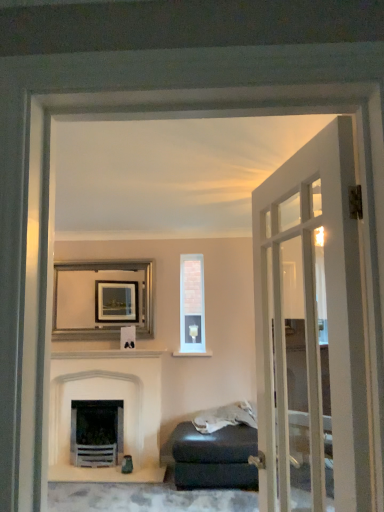
Question: Is matte black ottoman at lower right outside white glass door at right?

Choices:
 (A) no
 (B) yes

Answer: (B)

Question: Would you say matte black ottoman at lower right is a long distance from white glass door at right?

Choices:
 (A) yes
 (B) no

Answer: (B)

Question: From the image's perspective, would you say matte black ottoman at lower right is positioned over white glass door at right?

Choices:
 (A) no
 (B) yes

Answer: (A)

Question: Could you tell me if matte black ottoman at lower right is turned towards white glass door at right?

Choices:
 (A) yes
 (B) no

Answer: (B)

Question: Could white glass door at right be considered to be inside matte black ottoman at lower right?

Choices:
 (A) no
 (B) yes

Answer: (A)

Question: Is silver metallic picture frame at upper center situated inside gray leather ottoman at lower right or outside?

Choices:
 (A) inside
 (B) outside

Answer: (B)

Question: Considering the positions of silver metallic picture frame at upper center and gray leather ottoman at lower right in the image, is silver metallic picture frame at upper center bigger or smaller than gray leather ottoman at lower right?

Choices:
 (A) small
 (B) big

Answer: (A)

Question: Looking at their shapes, would you say silver metallic picture frame at upper center is wider or thinner than gray leather ottoman at lower right?

Choices:
 (A) thin
 (B) wide

Answer: (A)

Question: Is silver metallic picture frame at upper center in front of or behind gray leather ottoman at lower right in the image?

Choices:
 (A) front
 (B) behind

Answer: (B)

Question: From a real-world perspective, is white stone fireplace at center physically located above or below gray leather ottoman at lower right?

Choices:
 (A) above
 (B) below

Answer: (A)

Question: In terms of width, does white stone fireplace at center look wider or thinner when compared to gray leather ottoman at lower right?

Choices:
 (A) wide
 (B) thin

Answer: (A)

Question: In terms of height, does white stone fireplace at center look taller or shorter compared to gray leather ottoman at lower right?

Choices:
 (A) short
 (B) tall

Answer: (B)

Question: Considering the positions of white stone fireplace at center and gray leather ottoman at lower right in the image, is white stone fireplace at center bigger or smaller than gray leather ottoman at lower right?

Choices:
 (A) big
 (B) small

Answer: (A)

Question: From a real-world perspective, relative to gray leather ottoman at lower right, is matte black ottoman at lower right vertically above or below?

Choices:
 (A) above
 (B) below

Answer: (B)

Question: Looking at their shapes, would you say matte black ottoman at lower right is wider or thinner than gray leather ottoman at lower right?

Choices:
 (A) wide
 (B) thin

Answer: (A)